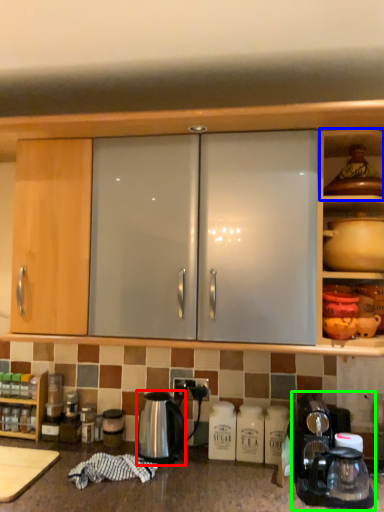
Question: Based on their relative distances, which object is nearer to kettle (highlighted by a red box)? Choose from shelf (highlighted by a blue box) and coffee machine (highlighted by a green box).

Choices:
 (A) shelf
 (B) coffee machine

Answer: (B)